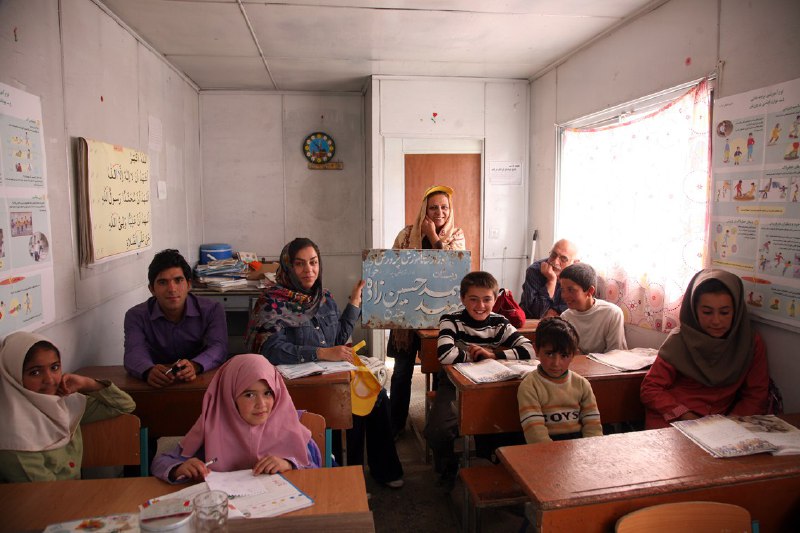
You are a GUI agent. You are given a task and a screenshot of the screen. Output one action in this format:
    pyautogui.click(x=<x>, y=<y>)
    Task: Click on the desks
    The image size is (800, 533).
    Given the screenshot: What is the action you would take?
    coord(634,462), coord(585,360), coord(529,321), coord(110,374), coord(108,496), coord(238,301)